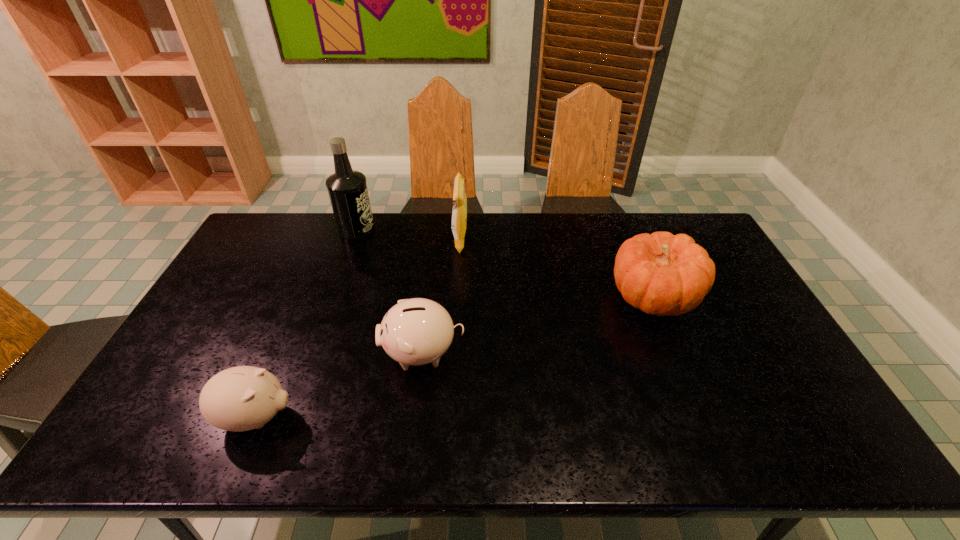
Identify the location of blank area in the image that satisfies the following two spatial constraints: 1. on the front label of the farther piggy bank; 2. on the left side of the tallest object. (313, 353).

At what (x,y) coordinates should I click in order to perform the action: click on vacant position in the image that satisfies the following two spatial constraints: 1. on the back side of the pumpkin; 2. on the front of the crisp (potato chip) with the logo. Please return your answer as a coordinate pair (x, y). The image size is (960, 540). Looking at the image, I should click on (630, 241).

The width and height of the screenshot is (960, 540). In order to click on vacant space that satisfies the following two spatial constraints: 1. on the front label of the tallest object; 2. on the back side of the rightmost object in this screenshot , I will do `click(333, 296)`.